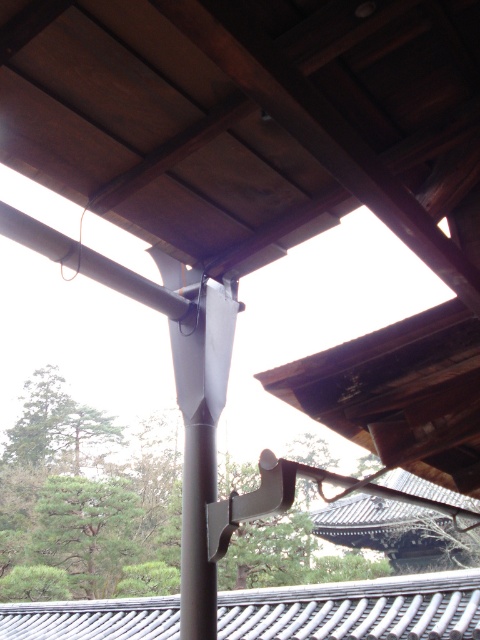
Question: Does dark brown wood at center come behind gray tile roof at lower center?

Choices:
 (A) yes
 (B) no

Answer: (B)

Question: Which object appears closest to the camera in this image?

Choices:
 (A) dark brown wood at center
 (B) gray tile roof at lower center

Answer: (A)

Question: Which object appears closest to the camera in this image?

Choices:
 (A) gray tile roof at lower center
 (B) dark brown wood at center

Answer: (B)

Question: Which of the following is the farthest from the observer?

Choices:
 (A) (266, 628)
 (B) (287, 97)

Answer: (A)

Question: Is dark brown wood at center above gray tile roof at lower center?

Choices:
 (A) no
 (B) yes

Answer: (B)

Question: Does dark brown wood at center have a larger size compared to gray tile roof at lower center?

Choices:
 (A) no
 (B) yes

Answer: (A)